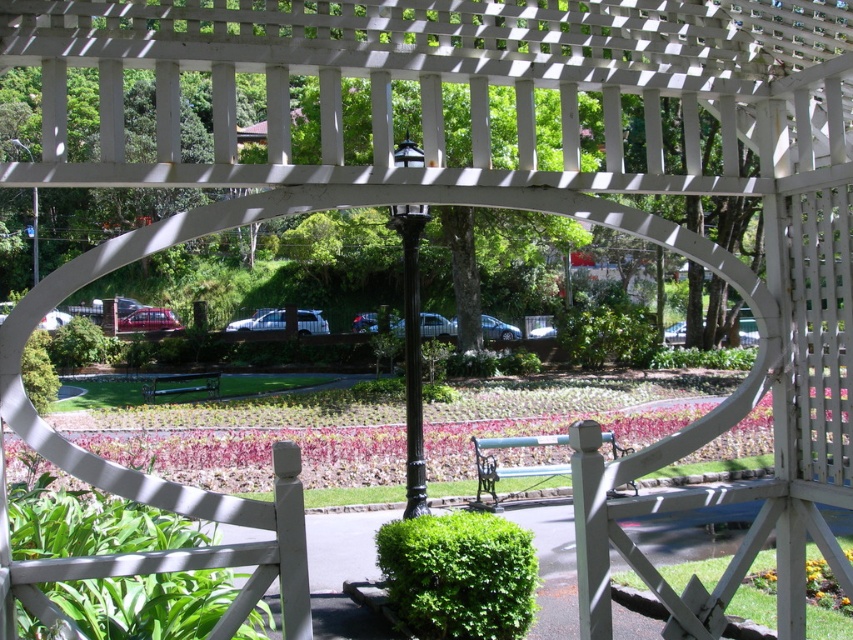
Is green painted wood bench at center behind green wooden bench at center?

No.

Is green painted wood bench at center taller than green wooden bench at center?

Correct, green painted wood bench at center is much taller as green wooden bench at center.

Between point (495, 444) and point (167, 392), which one is positioned in front?

Point (495, 444) is more forward.

Locate an element on the screen. The image size is (853, 640). green painted wood bench at center is located at coordinates [x=509, y=467].

Is point (566, 416) behind point (498, 477)?

Yes, point (566, 416) is farther from viewer.

Does pink matte flower at center have a larger size compared to green painted wood bench at center?

Yes.

The height and width of the screenshot is (640, 853). Identify the location of pink matte flower at center. (256, 454).

Consider the image. Between pink matte flower at center and green wooden bench at center, which one is positioned higher?

pink matte flower at center is higher up.

This screenshot has width=853, height=640. I want to click on pink matte flower at center, so click(x=256, y=454).